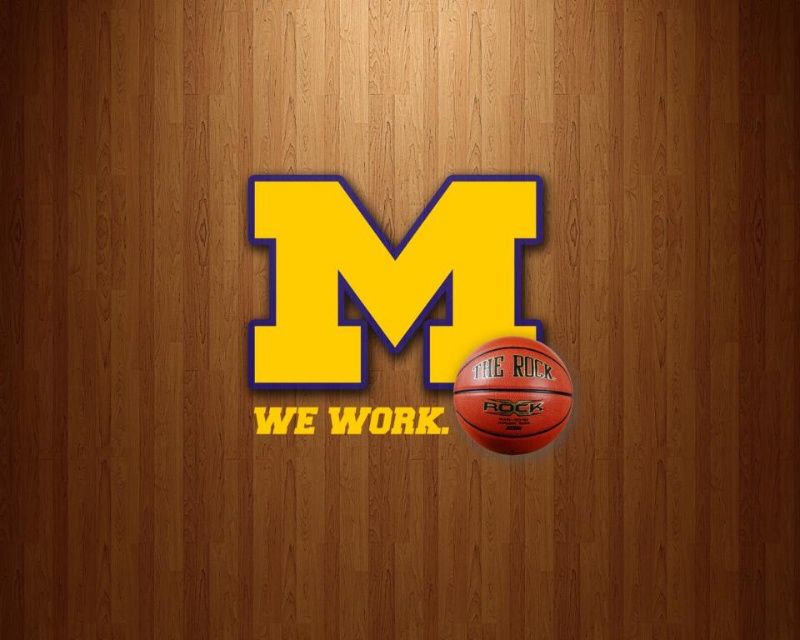
Image resolution: width=800 pixels, height=640 pixels. Find the location of `rubber textured basketball at center`. rubber textured basketball at center is located at coordinates (409, 298).

Is rubber textured basketball at center thinner than rubber textured basketball at lower right?

Incorrect, rubber textured basketball at center's width is not less than rubber textured basketball at lower right's.

Between point (509, 385) and point (504, 401), which one is positioned behind?

Point (504, 401)

Where is `rubber textured basketball at center`? The height and width of the screenshot is (640, 800). rubber textured basketball at center is located at coordinates (409, 298).